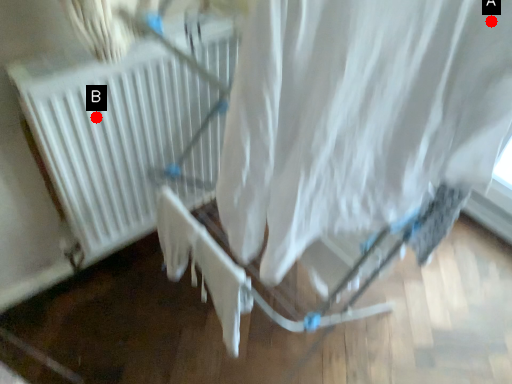
Question: Two points are circled on the image, labeled by A and B beside each circle. Which point appears closest to the camera in this image?

Choices:
 (A) A is closer
 (B) B is closer

Answer: (A)